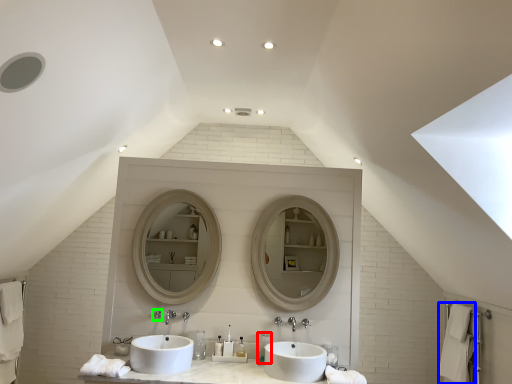
Question: Estimate the real-world distances between objects in this image. Which object is farther from toiletry (highlighted by a red box), bath towel (highlighted by a blue box) or plumbing fixture (highlighted by a green box)?

Choices:
 (A) bath towel
 (B) plumbing fixture

Answer: (A)